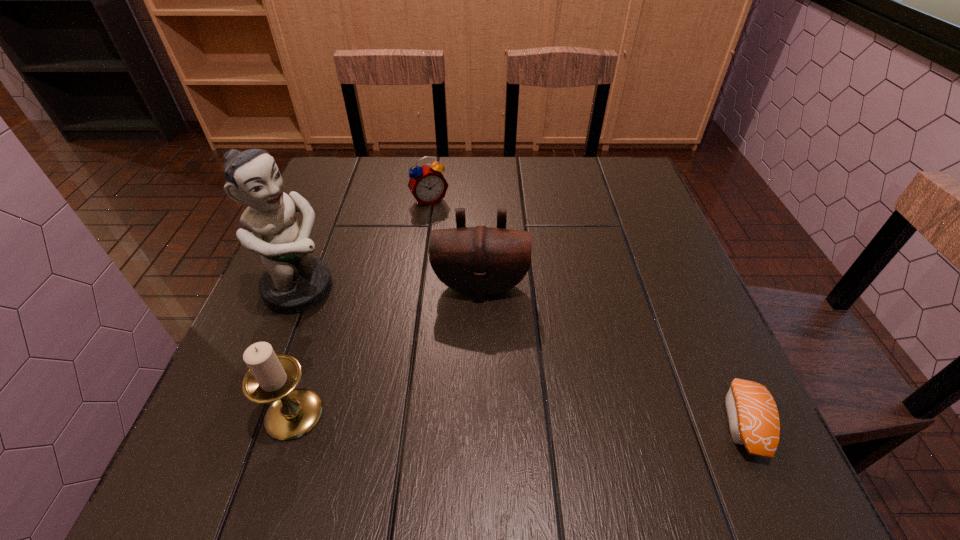
Image resolution: width=960 pixels, height=540 pixels. I want to click on blank area located on the front-facing side of the alarm clock, so click(443, 220).

Image resolution: width=960 pixels, height=540 pixels. I want to click on free point located on the front-facing side of the alarm clock, so click(x=456, y=241).

Where is `free region located 0.070m with the flap open on the pouch`? The height and width of the screenshot is (540, 960). free region located 0.070m with the flap open on the pouch is located at coordinates (478, 332).

Where is `free space located 0.090m with the flap open on the pouch`? The height and width of the screenshot is (540, 960). free space located 0.090m with the flap open on the pouch is located at coordinates (477, 340).

The width and height of the screenshot is (960, 540). Identify the location of vacant space situated with the flap open on the pouch. (476, 382).

Where is `free space located 0.260m on the front-facing side of the tallest object`? The image size is (960, 540). free space located 0.260m on the front-facing side of the tallest object is located at coordinates (431, 360).

Locate an element on the screen. The width and height of the screenshot is (960, 540). free space located 0.120m on the front-facing side of the tallest object is located at coordinates (372, 328).

This screenshot has height=540, width=960. I want to click on free location located on the front-facing side of the tallest object, so click(x=396, y=341).

You are a GUI agent. You are given a task and a screenshot of the screen. Output one action in this format:
    pyautogui.click(x=<x>, y=<y>)
    Task: Click on the object that is at the far edge
    The height and width of the screenshot is (540, 960).
    Given the screenshot: What is the action you would take?
    pyautogui.click(x=427, y=184)

You are a GUI agent. You are given a task and a screenshot of the screen. Output one action in this format:
    pyautogui.click(x=<x>, y=<y>)
    Task: Click on the candle holder present at the near edge
    Image resolution: width=960 pixels, height=540 pixels.
    Given the screenshot: What is the action you would take?
    pyautogui.click(x=272, y=378)